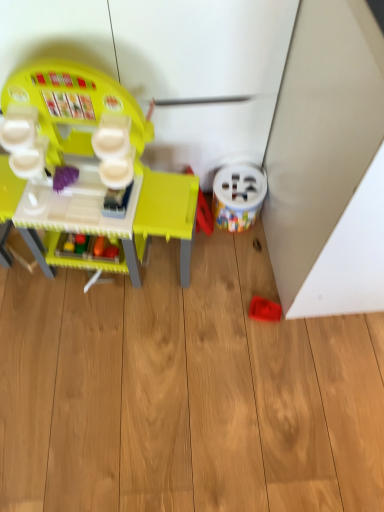
I want to click on unoccupied region to the right of matte plastic play kitchen at left, positioned as the third toy in right-to-left order, so click(231, 307).